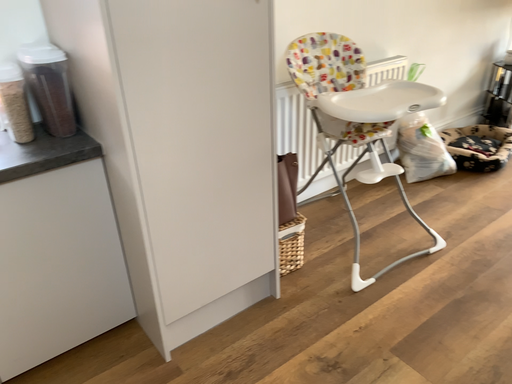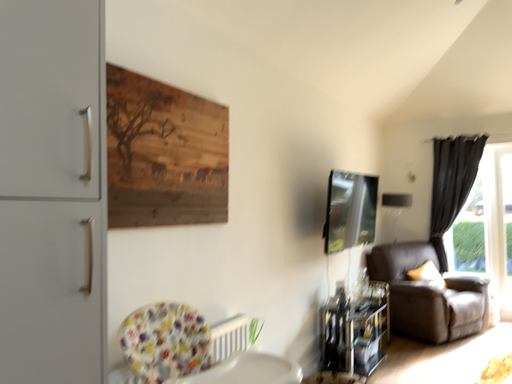
Question: Which way did the camera rotate in the video?

Choices:
 (A) rotated upward
 (B) rotated downward

Answer: (A)